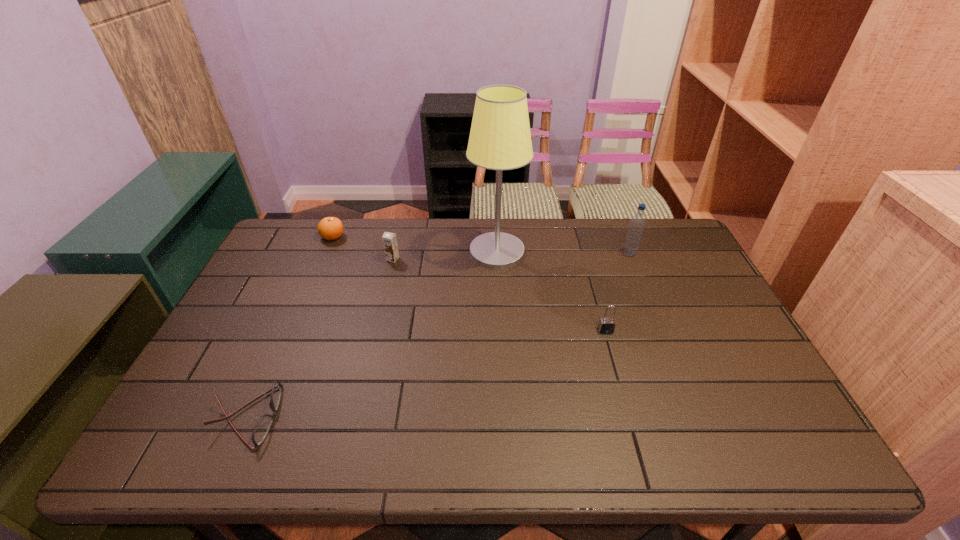
The image size is (960, 540). What are the coordinates of `object that is the fifth closest to the second shortest object` in the screenshot? It's located at (636, 227).

What are the coordinates of `free space that satisfies the following two spatial constraints: 1. on the shackle of the fifth object from left to right; 2. on the front-facing side of the nearest object` in the screenshot? It's located at (631, 417).

Identify the location of free space that satisfies the following two spatial constraints: 1. on the back side of the fourth object from right to left; 2. on the left side of the fifth shortest object. (395, 253).

You are a GUI agent. You are given a task and a screenshot of the screen. Output one action in this format:
    pyautogui.click(x=<x>, y=<y>)
    Task: Click on the vacant space that satisfies the following two spatial constraints: 1. on the shackle of the second object from right to left; 2. on the front-facing side of the shortest object
    Image resolution: width=960 pixels, height=540 pixels.
    Given the screenshot: What is the action you would take?
    pyautogui.click(x=631, y=417)

Image resolution: width=960 pixels, height=540 pixels. I want to click on blank space that satisfies the following two spatial constraints: 1. on the back side of the fourth object from right to left; 2. on the left side of the tallest object, so click(x=395, y=252).

The image size is (960, 540). I want to click on free point that satisfies the following two spatial constraints: 1. on the front side of the chocolate milk; 2. on the right side of the second shortest object, so click(x=323, y=259).

You are a GUI agent. You are given a task and a screenshot of the screen. Output one action in this format:
    pyautogui.click(x=<x>, y=<y>)
    Task: Click on the free space that satisfies the following two spatial constraints: 1. on the front side of the clementine; 2. on the front-facing side of the nearest object
    Image resolution: width=960 pixels, height=540 pixels.
    Given the screenshot: What is the action you would take?
    pyautogui.click(x=255, y=417)

Where is `free location that satisfies the following two spatial constraints: 1. on the back side of the third object from left to right; 2. on the right side of the water bottle`? The image size is (960, 540). free location that satisfies the following two spatial constraints: 1. on the back side of the third object from left to right; 2. on the right side of the water bottle is located at coordinates (395, 253).